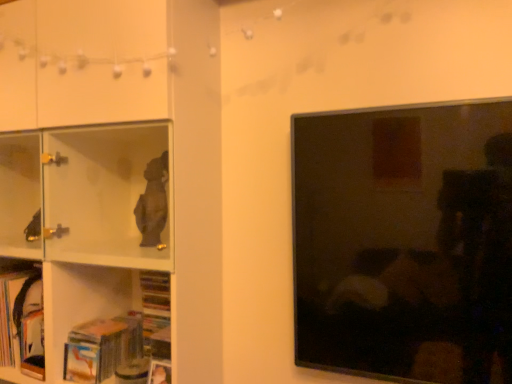
Question: Can you confirm if hardcover book at lower left, acting as the second book starting from the left, is wider than white glossy shelf at left?

Choices:
 (A) yes
 (B) no

Answer: (B)

Question: From the image's perspective, is hardcover book at lower left, acting as the second book starting from the left, over white glossy shelf at left?

Choices:
 (A) yes
 (B) no

Answer: (B)

Question: Is hardcover book at lower left, acting as the second book starting from the left, beside white glossy shelf at left?

Choices:
 (A) yes
 (B) no

Answer: (B)

Question: From the image's perspective, would you say hardcover book at lower left, positioned as the 1th book in right-to-left order, is shown under white glossy shelf at left?

Choices:
 (A) no
 (B) yes

Answer: (B)

Question: Does hardcover book at lower left, positioned as the 1th book in right-to-left order, have a lesser height compared to white glossy shelf at left?

Choices:
 (A) no
 (B) yes

Answer: (B)

Question: Relative to hardcover book at lower left, which is the 1th book from left to right, is hardcover book at lower left, acting as the second book starting from the left, in front or behind?

Choices:
 (A) behind
 (B) front

Answer: (B)

Question: From the image's perspective, is hardcover book at lower left, positioned as the 1th book in right-to-left order, above or below hardcover book at lower left, which is the 1th book from left to right?

Choices:
 (A) above
 (B) below

Answer: (B)

Question: From a real-world perspective, is hardcover book at lower left, positioned as the 1th book in right-to-left order, above or below hardcover book at lower left, which is the 2th book from right to left?

Choices:
 (A) above
 (B) below

Answer: (B)

Question: Is hardcover book at lower left, positioned as the 1th book in right-to-left order, wider or thinner than hardcover book at lower left, which is the 1th book from left to right?

Choices:
 (A) wide
 (B) thin

Answer: (A)

Question: In terms of height, does hardcover book at lower left, acting as the second book starting from the left, look taller or shorter compared to matte black tv at right?

Choices:
 (A) tall
 (B) short

Answer: (B)

Question: Relative to matte black tv at right, is hardcover book at lower left, acting as the second book starting from the left, in front or behind?

Choices:
 (A) front
 (B) behind

Answer: (B)

Question: Does point (83, 352) appear closer or farther from the camera than point (478, 134)?

Choices:
 (A) closer
 (B) farther

Answer: (B)

Question: From a real-world perspective, relative to matte black tv at right, is hardcover book at lower left, positioned as the 1th book in right-to-left order, vertically above or below?

Choices:
 (A) above
 (B) below

Answer: (B)

Question: In the image, is matte black tv at right positioned in front of or behind hardcover book at lower left, positioned as the 1th book in right-to-left order?

Choices:
 (A) front
 (B) behind

Answer: (A)

Question: In terms of height, does matte black tv at right look taller or shorter compared to hardcover book at lower left, acting as the second book starting from the left?

Choices:
 (A) short
 (B) tall

Answer: (B)